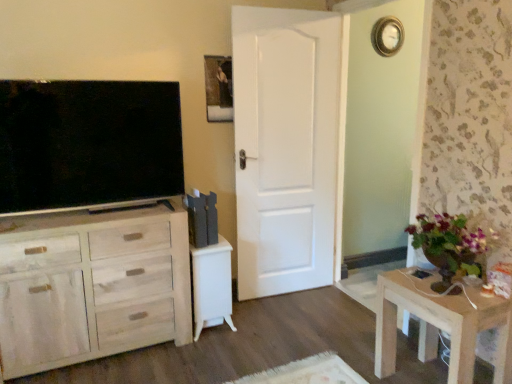
Question: Does wooden table at lower right appear on the right side of gold-toned metallic clock at upper right?

Choices:
 (A) yes
 (B) no

Answer: (B)

Question: From a real-world perspective, is wooden table at lower right below gold-toned metallic clock at upper right?

Choices:
 (A) no
 (B) yes

Answer: (B)

Question: Is wooden table at lower right turned away from gold-toned metallic clock at upper right?

Choices:
 (A) yes
 (B) no

Answer: (B)

Question: Would you say wooden table at lower right contains gold-toned metallic clock at upper right?

Choices:
 (A) no
 (B) yes

Answer: (A)

Question: Considering the relative positions of wooden table at lower right and gold-toned metallic clock at upper right in the image provided, is wooden table at lower right to the left of gold-toned metallic clock at upper right from the viewer's perspective?

Choices:
 (A) yes
 (B) no

Answer: (A)

Question: Does wooden table at lower right have a smaller size compared to gold-toned metallic clock at upper right?

Choices:
 (A) yes
 (B) no

Answer: (B)

Question: Is light wood cabinet at left completely or partially outside of wooden table at lower right?

Choices:
 (A) no
 (B) yes

Answer: (B)

Question: From a real-world perspective, does light wood cabinet at left stand above wooden table at lower right?

Choices:
 (A) no
 (B) yes

Answer: (B)

Question: Is wooden table at lower right located within light wood cabinet at left?

Choices:
 (A) yes
 (B) no

Answer: (B)

Question: Can you confirm if light wood cabinet at left is positioned to the left of wooden table at lower right?

Choices:
 (A) yes
 (B) no

Answer: (A)

Question: Does light wood cabinet at left turn towards wooden table at lower right?

Choices:
 (A) no
 (B) yes

Answer: (A)

Question: Is light wood cabinet at left facing away from wooden table at lower right?

Choices:
 (A) yes
 (B) no

Answer: (B)

Question: Considering the relative positions of gold-toned metallic clock at upper right and white glossy vanity at center in the image provided, is gold-toned metallic clock at upper right to the right of white glossy vanity at center from the viewer's perspective?

Choices:
 (A) no
 (B) yes

Answer: (B)